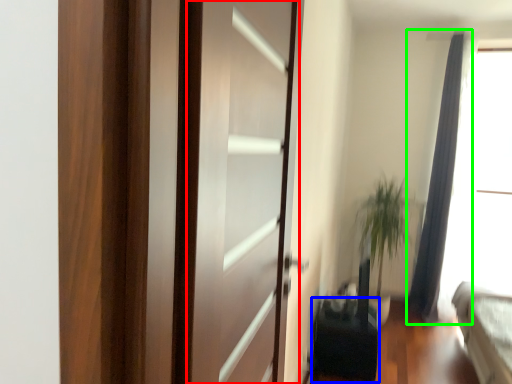
Question: Based on their relative distances, which object is farther from screen door (highlighted by a red box)? Choose from furniture (highlighted by a blue box) and curtain (highlighted by a green box).

Choices:
 (A) furniture
 (B) curtain

Answer: (B)